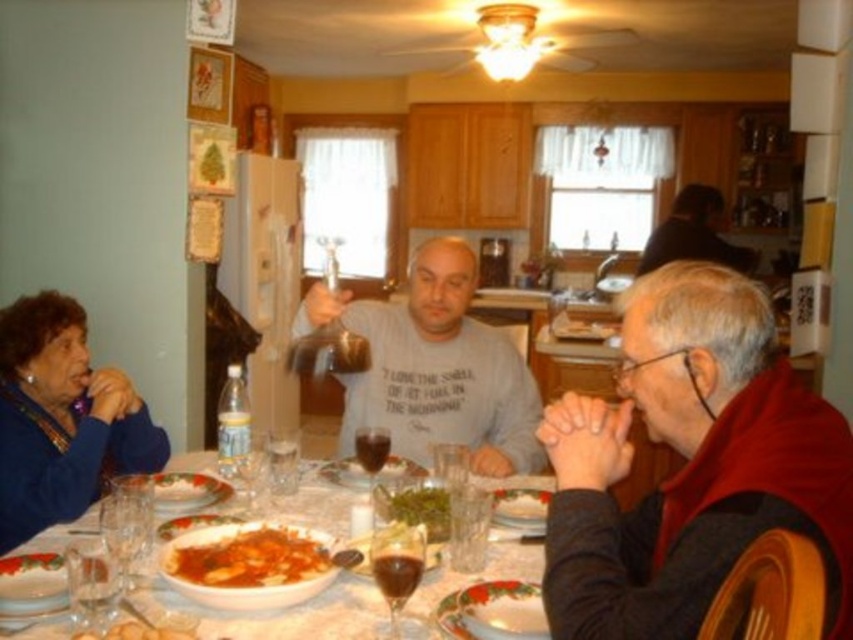
Question: Which point is closer to the camera taking this photo?

Choices:
 (A) (498, 509)
 (B) (397, 460)

Answer: (A)

Question: Which point appears farthest from the camera in this image?

Choices:
 (A) (523, 579)
 (B) (181, 484)
 (C) (166, 529)

Answer: (B)

Question: Among these objects, which one is nearest to the camera?

Choices:
 (A) white glossy plate at center
 (B) golden crispy pastry at lower center
 (C) white frosted cake at center
 (D) dark gray sweater at center

Answer: (B)

Question: Can you confirm if tomato sauce pasta at center is bigger than smooth white pasta at center?

Choices:
 (A) no
 (B) yes

Answer: (B)

Question: From the image, what is the correct spatial relationship of white frosted cake at center in relation to smooth white pasta at center?

Choices:
 (A) right
 (B) left

Answer: (B)

Question: From the image, what is the correct spatial relationship of green leafy vegetable at center in relation to translucent glass wine at center?

Choices:
 (A) left
 (B) right

Answer: (B)